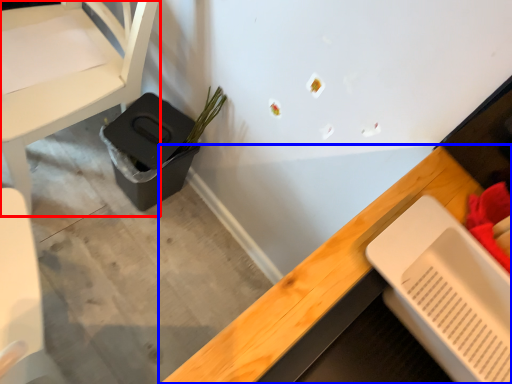
Question: Which of the following is the farthest to the observer, chair (highlighted by a red box) or desk (highlighted by a blue box)?

Choices:
 (A) chair
 (B) desk

Answer: (A)